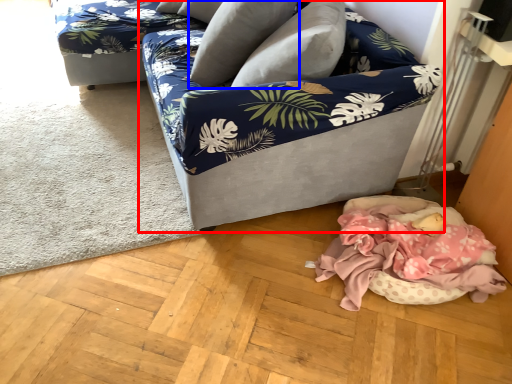
Question: Which of the following is the closest to the observer, studio couch (highlighted by a red box) or pillow (highlighted by a blue box)?

Choices:
 (A) studio couch
 (B) pillow

Answer: (A)